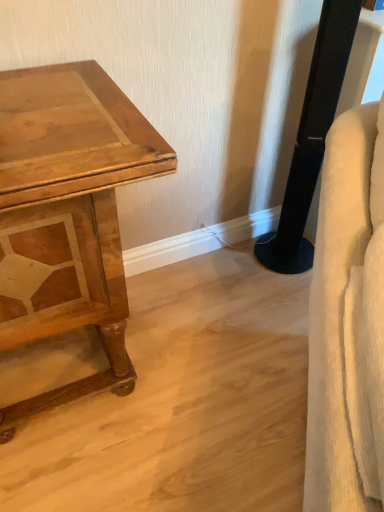
Find the location of a particular element. Image resolution: width=384 pixels, height=512 pixels. free space underneath wooden table at left (from a real-world perspective) is located at coordinates (64, 366).